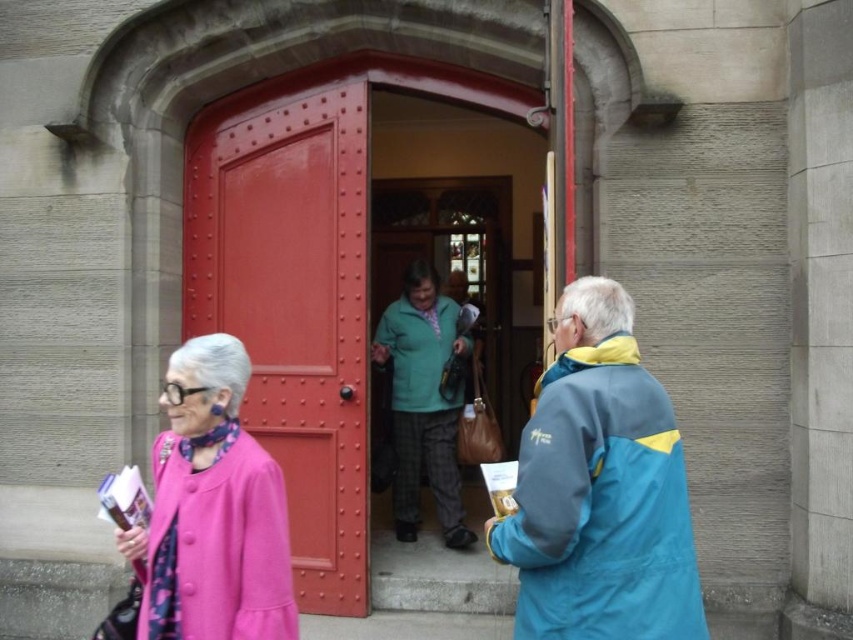
Question: Is smooth glossy wood door at center to the right of green matte jacket at center from the viewer's perspective?

Choices:
 (A) no
 (B) yes

Answer: (A)

Question: Does blue/yellow fabric jacket at right appear on the left side of green matte coat at center?

Choices:
 (A) yes
 (B) no

Answer: (B)

Question: Considering the real-world distances, which object is farthest from the smooth glossy wood door at center?

Choices:
 (A) teal fabric jacket at center
 (B) blue/yellow fabric jacket at right
 (C) green matte coat at center

Answer: (B)

Question: Estimate the real-world distances between objects in this image. Which object is farther from the green matte coat at center?

Choices:
 (A) blue/yellow fabric jacket at right
 (B) green matte jacket at center
 (C) teal fabric jacket at center

Answer: (A)

Question: Can you confirm if blue/yellow fabric jacket at right is bigger than green matte coat at center?

Choices:
 (A) yes
 (B) no

Answer: (A)

Question: Which point is farther to the camera?

Choices:
 (A) (459, 508)
 (B) (572, 392)
 (C) (221, 132)
 (D) (244, 570)

Answer: (A)